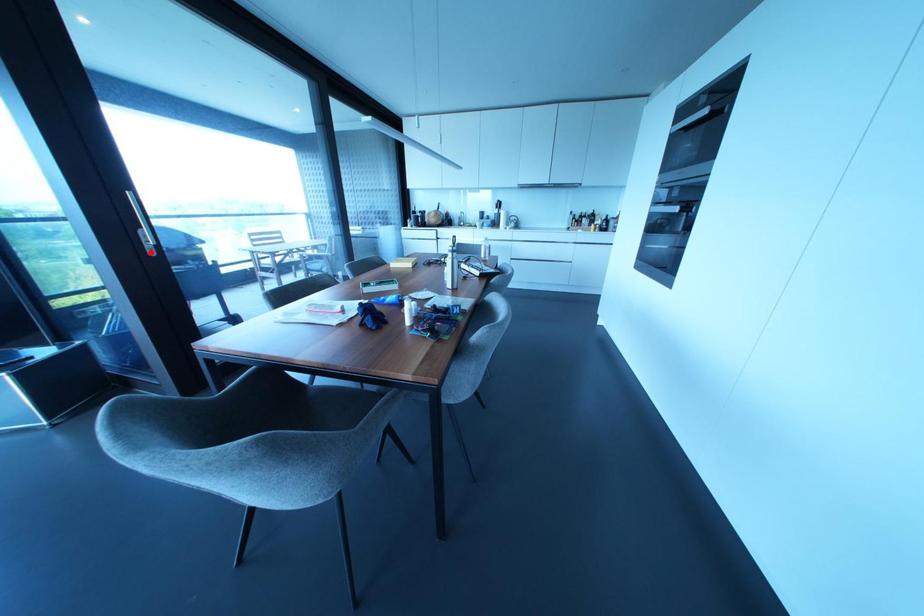
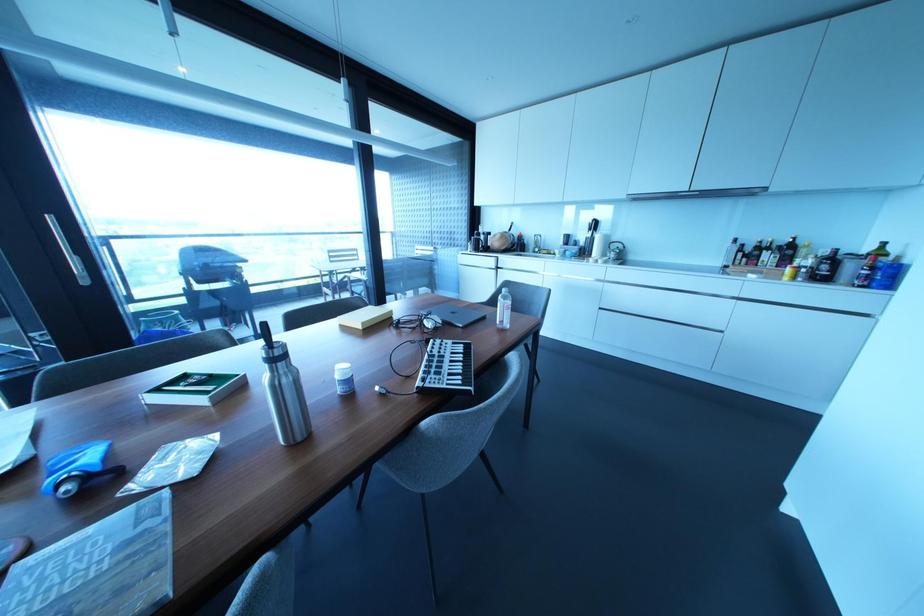
Locate, in the second image, the point that corresponds to the highlighted location in the first image.

(83, 281)